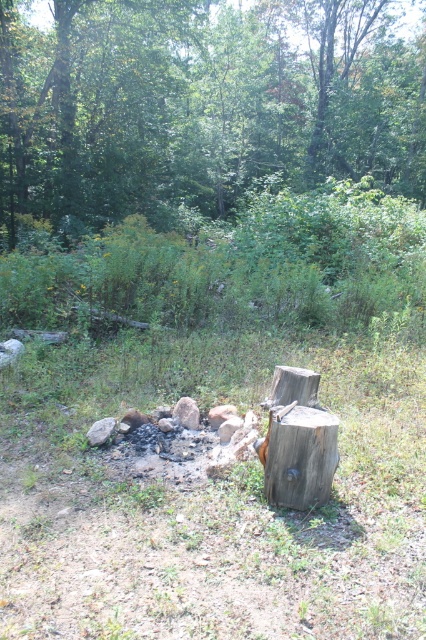
Question: Considering the relative positions of green leafy tree at upper center and weathered brown wood at center in the image provided, where is green leafy tree at upper center located with respect to weathered brown wood at center?

Choices:
 (A) right
 (B) left

Answer: (A)

Question: Does green leafy tree at upper center have a larger size compared to weathered brown wood at center?

Choices:
 (A) yes
 (B) no

Answer: (A)

Question: Which point is closer to the camera?

Choices:
 (A) (247, 49)
 (B) (327, 433)

Answer: (B)

Question: Is green leafy tree at upper center wider than weathered brown wood at center?

Choices:
 (A) no
 (B) yes

Answer: (B)